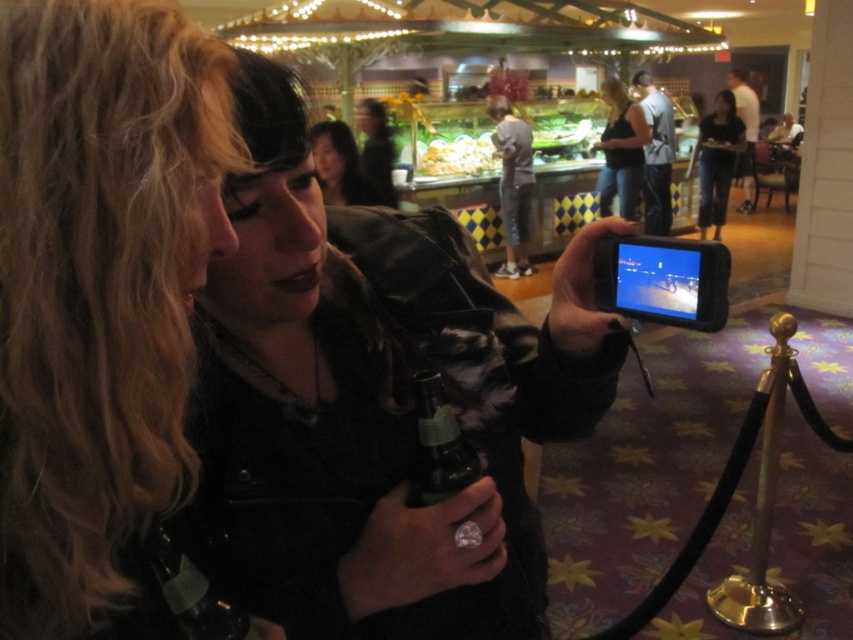
Question: Estimate the real-world distances between objects in this image. Which object is closer to the matte black tank top at center?

Choices:
 (A) black glossy tablet at right
 (B) blonde hair at center
 (C) matte black jacket at center
 (D) smooth black hair at upper center

Answer: (D)

Question: Which of the following is the closest to the observer?

Choices:
 (A) blonde hair at center
 (B) dark blue jeans at center
 (C) smooth black hair at upper center
 (D) matte black tank top at center

Answer: (A)

Question: Estimate the real-world distances between objects in this image. Which object is closer to the blonde hair at center?

Choices:
 (A) black glossy tablet at right
 (B) dark blue jeans at center

Answer: (A)

Question: Is matte black jacket at center positioned in front of blonde hair at center?

Choices:
 (A) yes
 (B) no

Answer: (B)

Question: Is black glossy tablet at right wider than smooth black hair at upper center?

Choices:
 (A) no
 (B) yes

Answer: (A)

Question: In this image, where is dark blue jeans at center located relative to smooth black hair at upper center?

Choices:
 (A) right
 (B) left

Answer: (A)